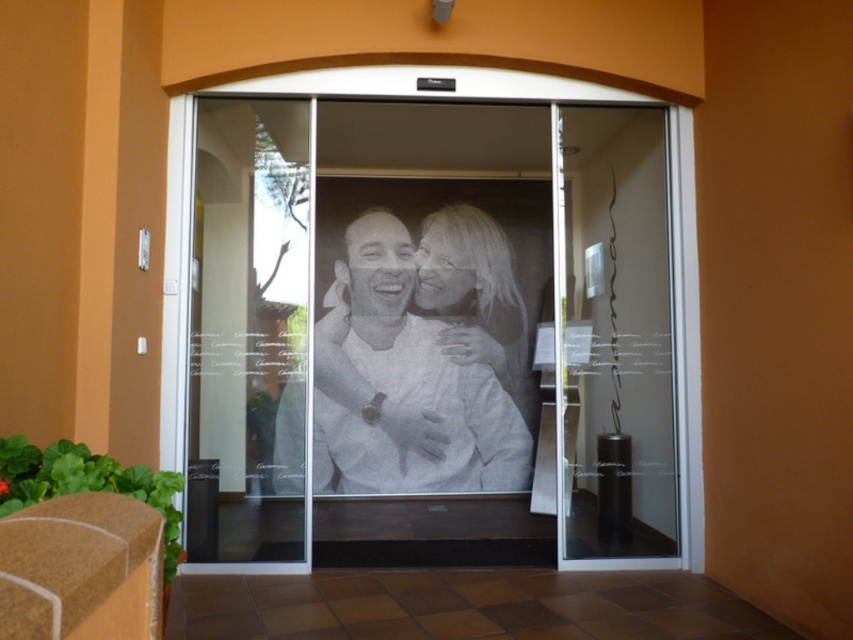
Is transparent glass screen door at center above transparent glass door at center?

Incorrect, transparent glass screen door at center is not positioned above transparent glass door at center.

Is transparent glass screen door at center wider than transparent glass door at center?

Indeed, transparent glass screen door at center has a greater width compared to transparent glass door at center.

In the scene shown: Who is more forward, (318, 156) or (244, 138)?

Point (244, 138)

In order to click on transparent glass screen door at center in this screenshot , I will do tap(445, 323).

Does transparent glass door at center have a lesser width compared to etched glass photo at center?

Correct, transparent glass door at center's width is less than etched glass photo at center's.

Is transparent glass door at center to the left of etched glass photo at center from the viewer's perspective?

Indeed, transparent glass door at center is positioned on the left side of etched glass photo at center.

Where is `transparent glass door at center`? transparent glass door at center is located at coordinates (248, 332).

Between point (376, 225) and point (395, 253), which one is positioned behind?

The point (376, 225) is more distant.

Does transparent glass screen door at center have a lesser height compared to etched glass photo at center?

In fact, transparent glass screen door at center may be taller than etched glass photo at center.

Find the location of a particular element. This screenshot has width=853, height=640. transparent glass screen door at center is located at coordinates (445, 323).